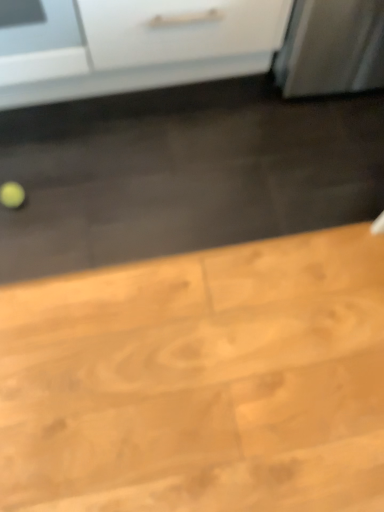
What do you see at coordinates (40, 41) in the screenshot? I see `white glossy refrigerator at upper left` at bounding box center [40, 41].

Locate an element on the screen. white glossy refrigerator at upper left is located at coordinates coord(40,41).

Describe the element at coordinates (200, 381) in the screenshot. The width and height of the screenshot is (384, 512). I see `wooden table at lower left` at that location.

What are the coordinates of `wooden table at lower left` in the screenshot? It's located at (200, 381).

What is the approximate height of wooden table at lower left?

2.83 centimeters.

Find the location of `white glossy refrigerator at upper left`. white glossy refrigerator at upper left is located at coordinates (40, 41).

Does wooden table at lower left appear on the left side of white glossy refrigerator at upper left?

No.

Which object is further away from the camera, wooden table at lower left or white glossy refrigerator at upper left?

Positioned behind is white glossy refrigerator at upper left.

Is point (202, 259) positioned before point (30, 53)?

No.

In the scene shown: From the image's perspective, is wooden table at lower left located beneath white glossy refrigerator at upper left?

Indeed, from the image's perspective, wooden table at lower left is shown beneath white glossy refrigerator at upper left.

From a real-world perspective, is wooden table at lower left positioned above or below white glossy refrigerator at upper left?

wooden table at lower left is situated lower than white glossy refrigerator at upper left in the real world.

Looking at their sizes, would you say wooden table at lower left is wider or thinner than white glossy refrigerator at upper left?

In the image, wooden table at lower left appears to be wider than white glossy refrigerator at upper left.

Which of these two, wooden table at lower left or white glossy refrigerator at upper left, stands shorter?

With less height is wooden table at lower left.

Based on their sizes in the image, would you say wooden table at lower left is bigger or smaller than white glossy refrigerator at upper left?

wooden table at lower left is smaller than white glossy refrigerator at upper left.

Choose the correct answer: Is wooden table at lower left inside white glossy refrigerator at upper left or outside it?

wooden table at lower left is spatially situated outside white glossy refrigerator at upper left.

Is the surface of wooden table at lower left in direct contact with white glossy refrigerator at upper left?

They are not placed beside each other.

Is wooden table at lower left positioned with its back to white glossy refrigerator at upper left?

No, wooden table at lower left's orientation is not away from white glossy refrigerator at upper left.

How many degrees apart are the facing directions of wooden table at lower left and white glossy refrigerator at upper left?

wooden table at lower left and white glossy refrigerator at upper left are facing 179 degrees away from each other.

This screenshot has height=512, width=384. Identify the location of appliance above the wooden table at lower left (from a real-world perspective). (40, 41).

Can you confirm if white glossy refrigerator at upper left is positioned to the left of wooden table at lower left?

Correct, you'll find white glossy refrigerator at upper left to the left of wooden table at lower left.

Which object is more forward, white glossy refrigerator at upper left or wooden table at lower left?

wooden table at lower left.

Does point (57, 17) appear closer or farther from the camera than point (10, 407)?

Point (57, 17) is farther from the camera than point (10, 407).

Looking at this image, from the image's perspective, is white glossy refrigerator at upper left located beneath wooden table at lower left?

Actually, white glossy refrigerator at upper left appears above wooden table at lower left in the image.

From the picture: From a real-world perspective, does white glossy refrigerator at upper left stand above wooden table at lower left?

Indeed, from a real-world perspective, white glossy refrigerator at upper left stands above wooden table at lower left.

In the scene shown: Which of these two, white glossy refrigerator at upper left or wooden table at lower left, is thinner?

white glossy refrigerator at upper left.

Considering the sizes of objects white glossy refrigerator at upper left and wooden table at lower left in the image provided, who is taller, white glossy refrigerator at upper left or wooden table at lower left?

white glossy refrigerator at upper left is taller.

Who is bigger, white glossy refrigerator at upper left or wooden table at lower left?

white glossy refrigerator at upper left is bigger.

Does white glossy refrigerator at upper left contain wooden table at lower left?

No, wooden table at lower left is not inside white glossy refrigerator at upper left.

Consider the image. Is white glossy refrigerator at upper left touching wooden table at lower left?

No, white glossy refrigerator at upper left is not touching wooden table at lower left.

Does white glossy refrigerator at upper left turn towards wooden table at lower left?

No, white glossy refrigerator at upper left does not turn towards wooden table at lower left.

Can you tell me how much white glossy refrigerator at upper left and wooden table at lower left differ in facing direction?

white glossy refrigerator at upper left and wooden table at lower left are facing 179 degrees away from each other.

Measure the distance between white glossy refrigerator at upper left and wooden table at lower left.

The distance of white glossy refrigerator at upper left from wooden table at lower left is 36.06 inches.

You are a GUI agent. You are given a task and a screenshot of the screen. Output one action in this format:
    pyautogui.click(x=<x>, y=<y>)
    Task: Click on the appliance behind the wooden table at lower left
    This screenshot has width=384, height=512.
    Given the screenshot: What is the action you would take?
    pyautogui.click(x=40, y=41)

The width and height of the screenshot is (384, 512). What are the coordinates of `appliance above the wooden table at lower left (from the image's perspective)` in the screenshot? It's located at (40, 41).

The image size is (384, 512). Identify the location of table in front of the white glossy refrigerator at upper left. (200, 381).